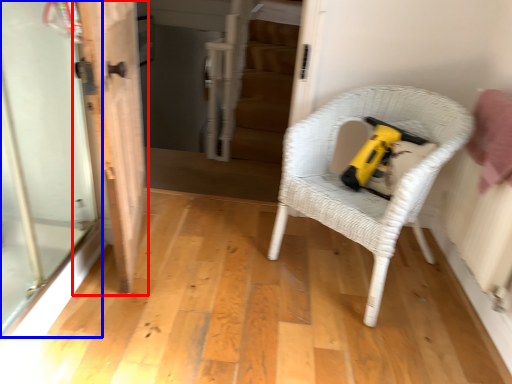
Question: Which of the following is the farthest to the observer, door (highlighted by a red box) or screen door (highlighted by a blue box)?

Choices:
 (A) door
 (B) screen door

Answer: (A)